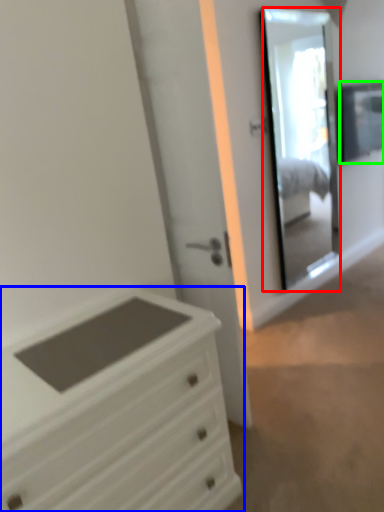
Question: Which object is positioned closest to mirror (highlighted by a red box)? Select from chest of drawers (highlighted by a blue box) and window (highlighted by a green box).

Choices:
 (A) chest of drawers
 (B) window

Answer: (B)